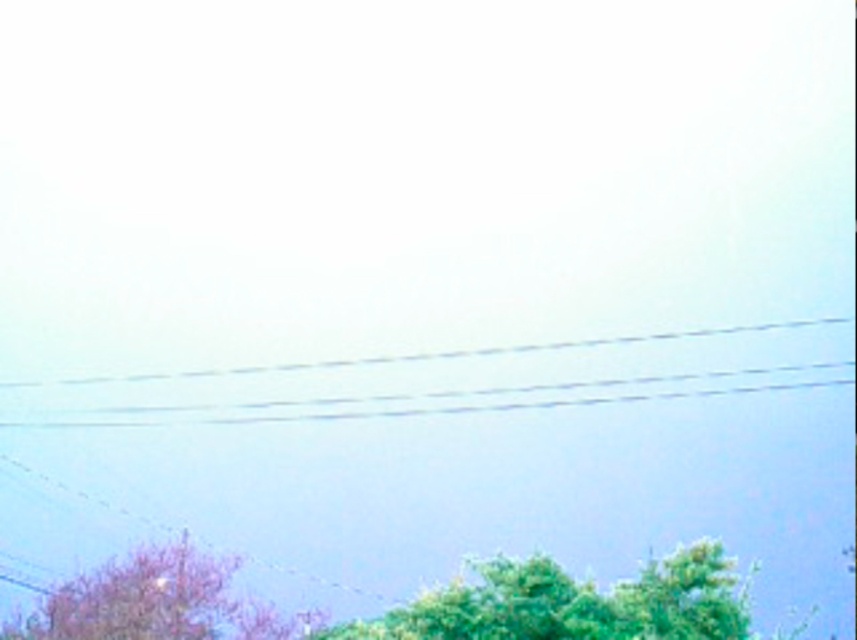
Between green leafy tree at lower center and pink matte tree at lower left, which one appears on the left side from the viewer's perspective?

pink matte tree at lower left

Does point (514, 620) come behind point (9, 634)?

No, (514, 620) is in front of (9, 634).

Identify the location of green leafy tree at lower center. Image resolution: width=857 pixels, height=640 pixels. (574, 602).

You are a GUI agent. You are given a task and a screenshot of the screen. Output one action in this format:
    pyautogui.click(x=<x>, y=<y>)
    Task: Click on the green leafy tree at lower center
    The height and width of the screenshot is (640, 857).
    Given the screenshot: What is the action you would take?
    pyautogui.click(x=574, y=602)

Which is more to the left, clear plastic power lines at center or green leafy tree at lower center?

From the viewer's perspective, clear plastic power lines at center appears more on the left side.

Between clear plastic power lines at center and green leafy tree at lower center, which one is positioned lower?

Positioned lower is green leafy tree at lower center.

Between point (646, 369) and point (349, 621), which one is positioned in front?

Positioned in front is point (349, 621).

You are a GUI agent. You are given a task and a screenshot of the screen. Output one action in this format:
    pyautogui.click(x=<x>, y=<y>)
    Task: Click on the clear plastic power lines at center
    The image size is (857, 640).
    Given the screenshot: What is the action you would take?
    pyautogui.click(x=452, y=380)

Is clear plastic power lines at center to the right of pink matte tree at lower left from the viewer's perspective?

Yes, clear plastic power lines at center is to the right of pink matte tree at lower left.

Which is more to the right, clear plastic power lines at center or pink matte tree at lower left?

From the viewer's perspective, clear plastic power lines at center appears more on the right side.

Is point (805, 337) behind point (106, 580)?

Yes, point (805, 337) is behind point (106, 580).

What are the coordinates of `clear plastic power lines at center` in the screenshot? It's located at (452, 380).